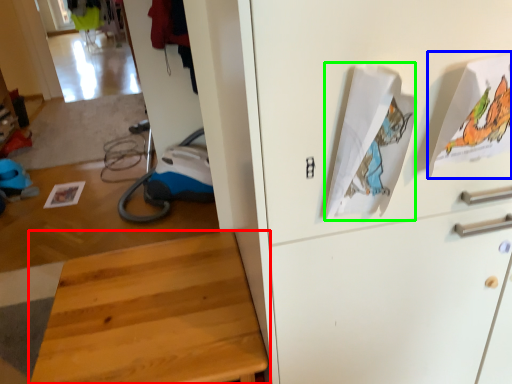
Question: Which object is positioned farthest from furniture (highlighted by a red box)? Select from wrapping paper (highlighted by a blue box) and wrapping paper (highlighted by a green box).

Choices:
 (A) wrapping paper
 (B) wrapping paper

Answer: (A)